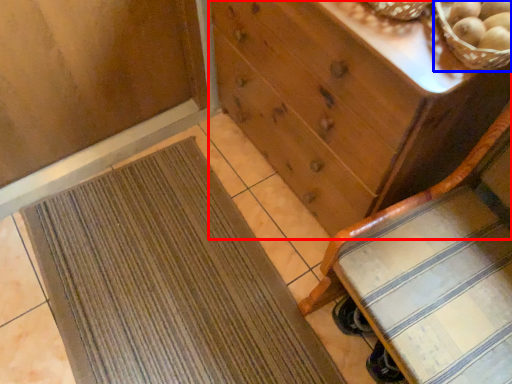
Question: Among these objects, which one is farthest to the camera, chest of drawers (highlighted by a red box) or basket (highlighted by a blue box)?

Choices:
 (A) chest of drawers
 (B) basket

Answer: (A)